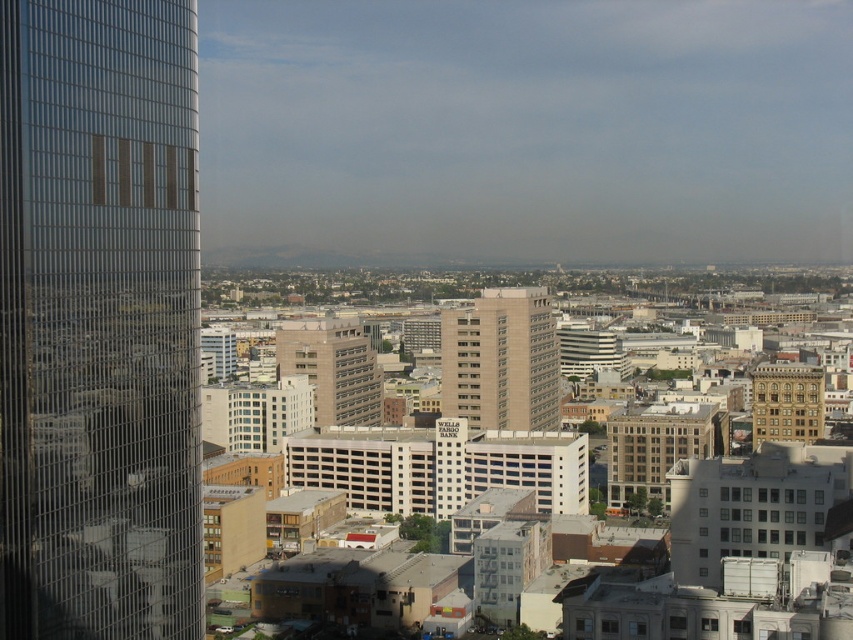
You are standing in the city and want to take a photo of both the glassy reflective skyscraper at left and the beige concrete building at center. Which building should you position yourself to the left of to capture both in your shot?

You should position yourself to the left of the glassy reflective skyscraper at left because it is to the left of the beige concrete building at center, so standing there would allow you to frame both in your photo.

You are an architect analyzing the city layout. From your current viewpoint, which structure is closer to you between the glassy reflective skyscraper at left and the beige stone building at center?

The glassy reflective skyscraper at left is closer to you as it is positioned over the beige stone building at center, indicating it is in front.